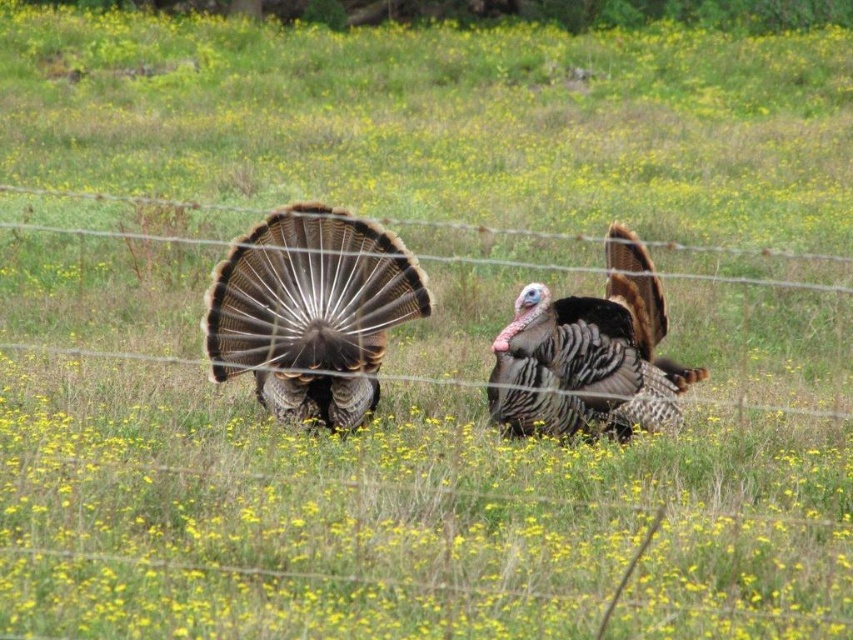
Consider the image. You are standing in the middle of the field and want to approach the two turkeys. Which point, point (302,403) or point (538,321), is closer to you?

Point (302,403) is closer to you than point (538,321).

You are a farmer observing two turkeys in your field. You notice the feathered brown turkey at center and the speckled feathered turkey at center. Which turkey is taller?

The feathered brown turkey at center is taller than the speckled feathered turkey at center.